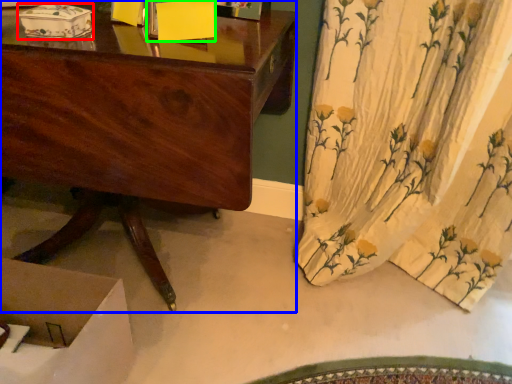
Question: Estimate the real-world distances between objects in this image. Which object is farther from box (highlighted by a red box), desk (highlighted by a blue box) or box (highlighted by a green box)?

Choices:
 (A) desk
 (B) box

Answer: (A)